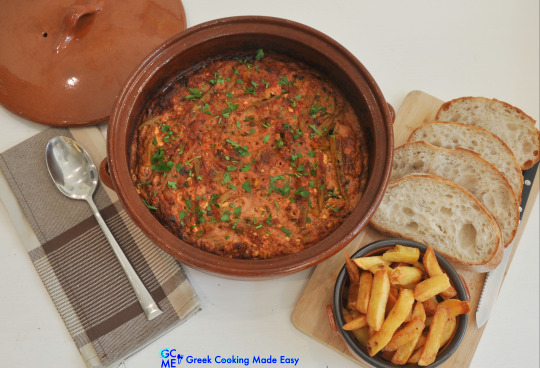
The width and height of the screenshot is (540, 368). Identify the location of napkin. (90, 263).